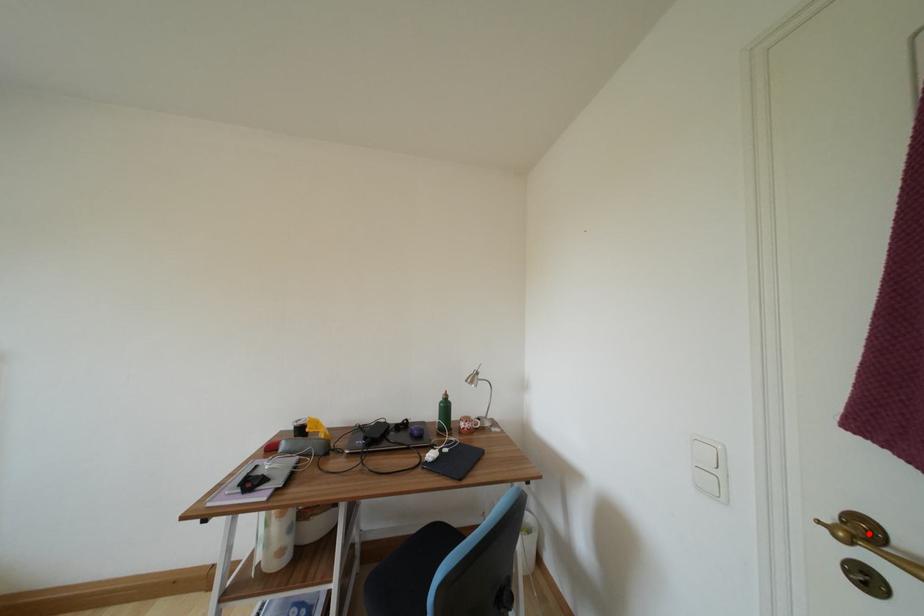
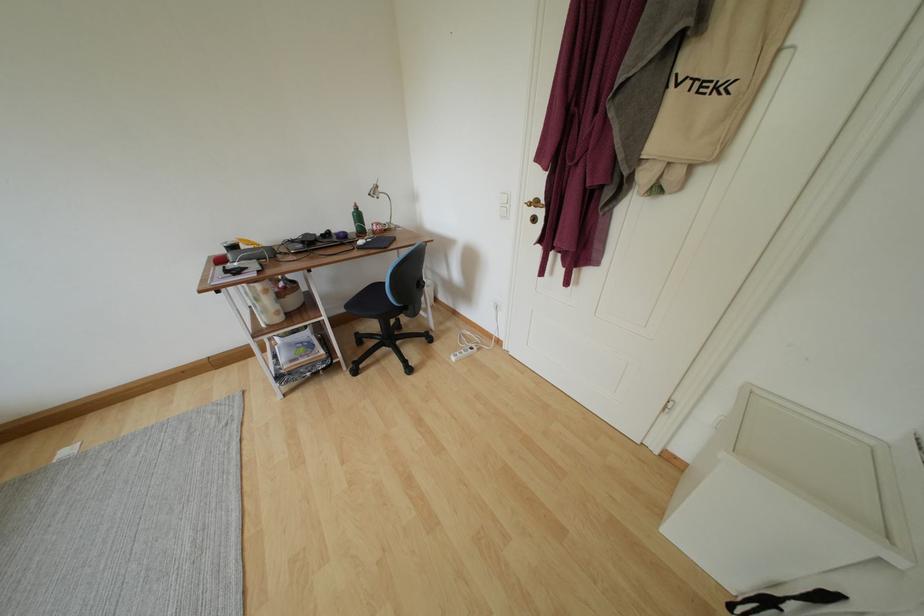
Find the pixel in the second image that matches the highlighted location in the first image.

(541, 207)